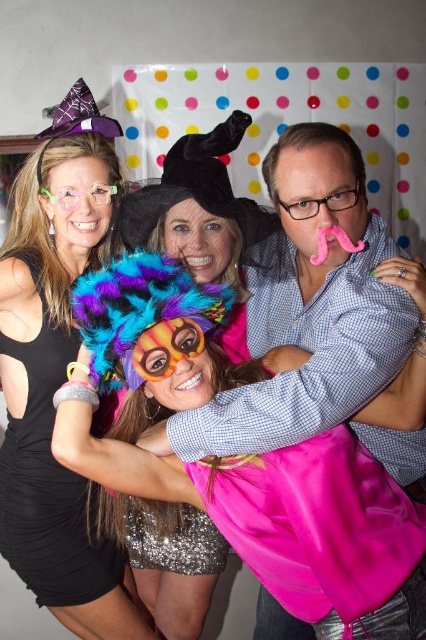
Which of these two, fuzzy multicolored wig at center or black satin dress at left, stands shorter?

fuzzy multicolored wig at center

Is fuzzy multicolored wig at center below black satin dress at left?

No, fuzzy multicolored wig at center is not below black satin dress at left.

In order to click on fuzzy multicolored wig at center in this screenshot , I will do `click(199, 216)`.